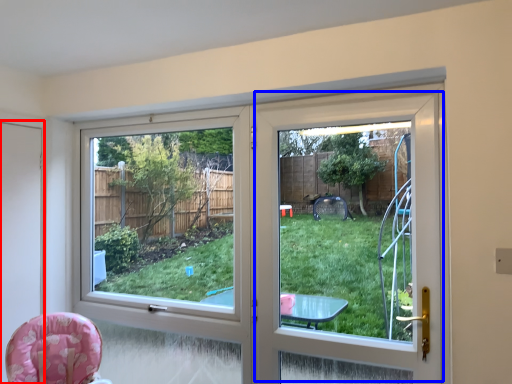
Question: Among these objects, which one is nearest to the camera, screen door (highlighted by a red box) or screen door (highlighted by a blue box)?

Choices:
 (A) screen door
 (B) screen door

Answer: (B)